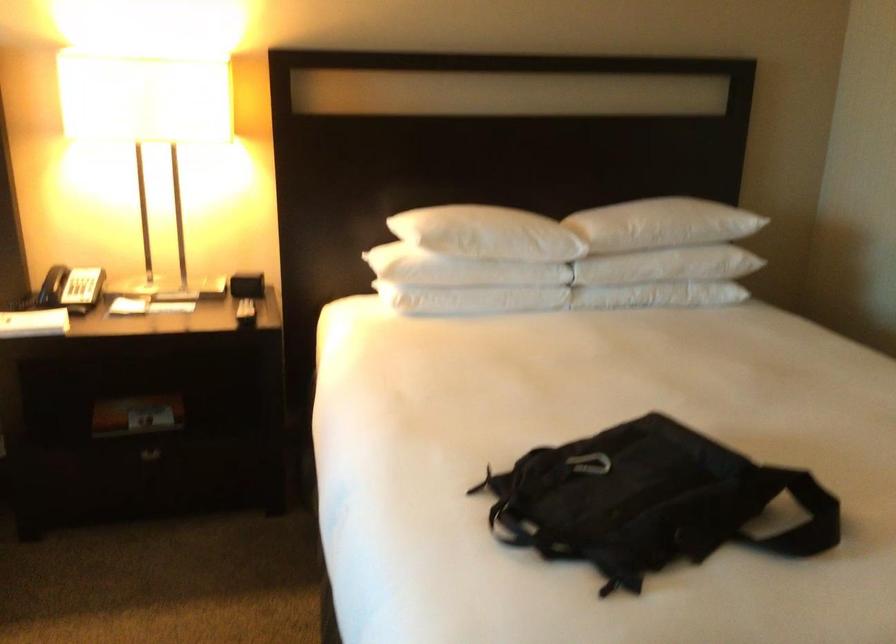
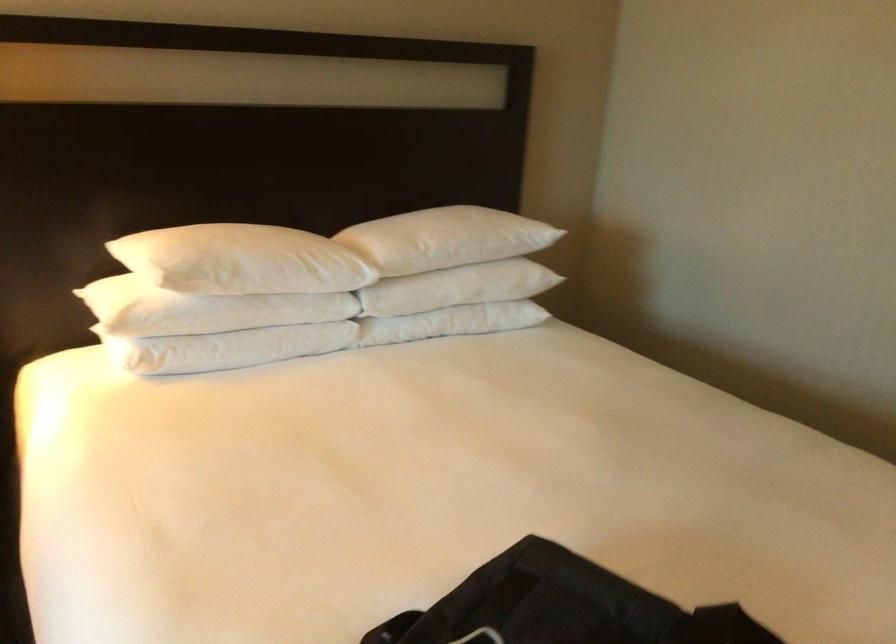
The point at (655, 218) is marked in the first image. Where is the corresponding point in the second image?

(449, 238)